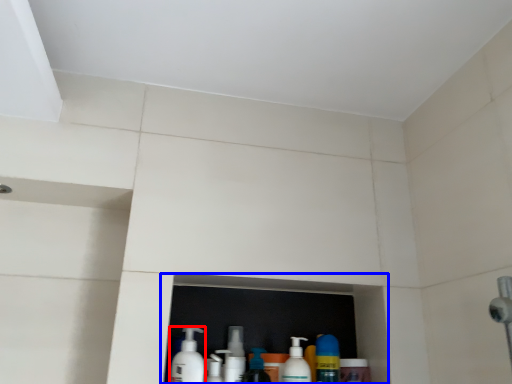
Question: Which point is further to the camera, cleaning product (highlighted by a red box) or shelf (highlighted by a blue box)?

Choices:
 (A) cleaning product
 (B) shelf

Answer: (B)